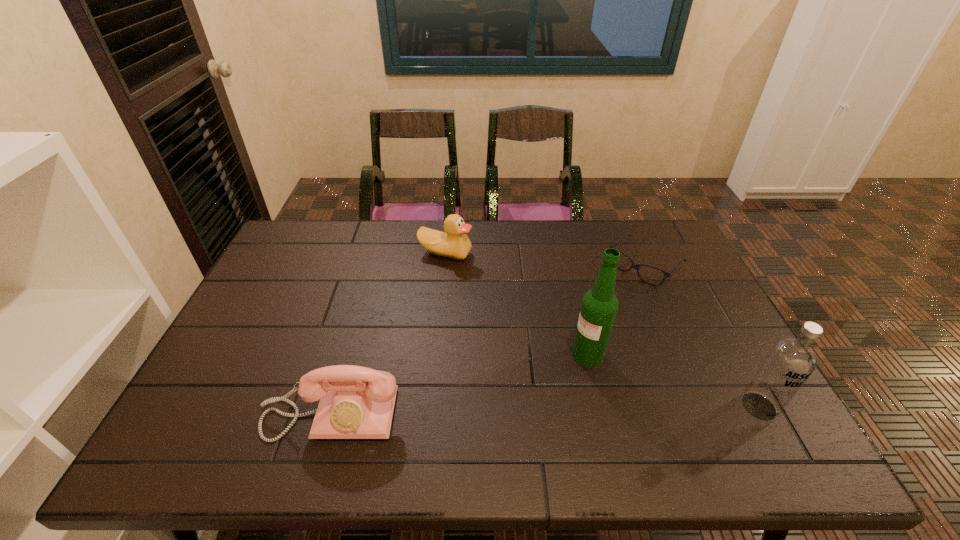
The height and width of the screenshot is (540, 960). I want to click on telephone, so click(356, 402).

This screenshot has width=960, height=540. Find the location of `vodka`. vodka is located at coordinates (790, 361).

Image resolution: width=960 pixels, height=540 pixels. I want to click on duck, so click(x=454, y=243).

This screenshot has height=540, width=960. Identify the location of the shortest object. (636, 266).

Where is `the third nearest object`? the third nearest object is located at coordinates (599, 306).

Find the location of a particular element. the tallest object is located at coordinates (599, 306).

In order to click on free region located 0.370m at the beak of the duck in this screenshot , I will do `click(510, 341)`.

I want to click on vacant space situated 0.340m at the beak of the duck, so click(x=505, y=333).

Where is `free region located at the beak of the duck`? This screenshot has height=540, width=960. free region located at the beak of the duck is located at coordinates (485, 303).

Locate an element on the screen. Image resolution: width=960 pixels, height=540 pixels. free region located on the front-facing side of the shortest object is located at coordinates (563, 343).